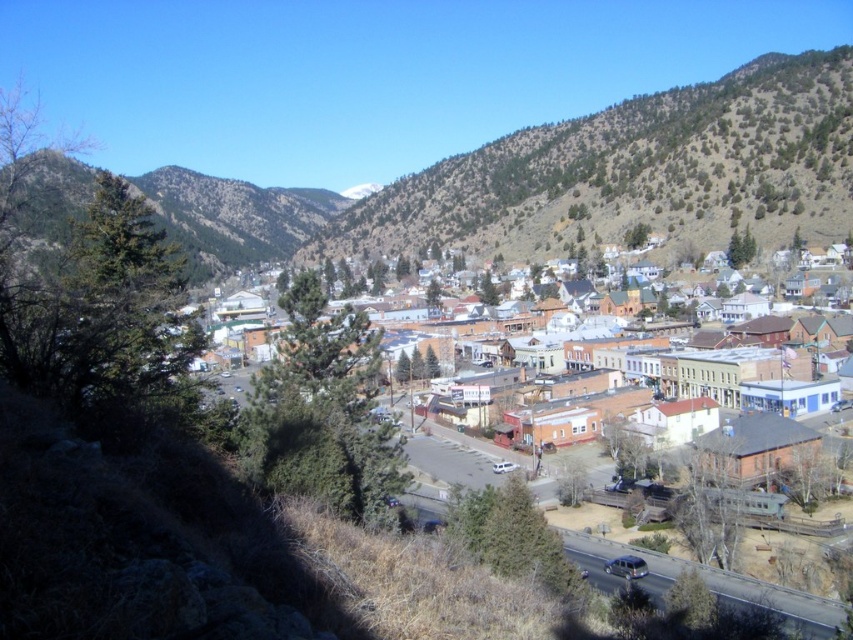
Between green leafy hillside at left and brown brick buildings at center, which one has less height?

With less height is brown brick buildings at center.

Which is more to the left, green leafy hillside at left or brown brick buildings at center?

Positioned to the left is green leafy hillside at left.

Is point (265, 244) more distant than point (846, 440)?

Yes, it is behind point (846, 440).

The width and height of the screenshot is (853, 640). In order to click on green leafy hillside at left in this screenshot , I will do `click(233, 218)`.

Who is positioned more to the left, brown/dry grassy hill at center or green leafy hillside at left?

Positioned to the left is green leafy hillside at left.

Which is below, brown/dry grassy hill at center or green leafy hillside at left?

green leafy hillside at left is lower down.

Describe the element at coordinates (636, 172) in the screenshot. I see `brown/dry grassy hill at center` at that location.

Where is `brown/dry grassy hill at center`? The height and width of the screenshot is (640, 853). brown/dry grassy hill at center is located at coordinates (636, 172).

Between brown/dry grassy hill at center and brown brick buildings at center, which one is positioned higher?

brown/dry grassy hill at center

Looking at this image, who is shorter, brown/dry grassy hill at center or brown brick buildings at center?

brown brick buildings at center

Who is more forward, [537,209] or [444,440]?

Point [444,440] is more forward.

You are a GUI agent. You are given a task and a screenshot of the screen. Output one action in this format:
    pyautogui.click(x=<x>, y=<y>)
    Task: Click on the brown/dry grassy hill at center
    
    Given the screenshot: What is the action you would take?
    pyautogui.click(x=636, y=172)